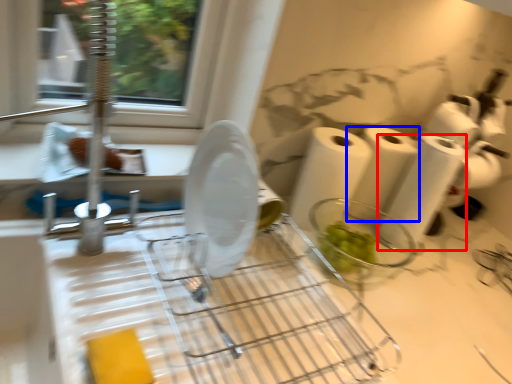
Question: Which point is further to the camera, toilet paper (highlighted by a red box) or paper towel (highlighted by a blue box)?

Choices:
 (A) toilet paper
 (B) paper towel

Answer: (B)